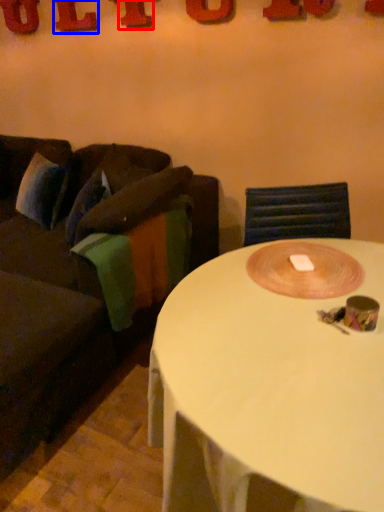
Question: Which object is further to the camera taking this photo, letter (highlighted by a red box) or letter (highlighted by a blue box)?

Choices:
 (A) letter
 (B) letter

Answer: (B)